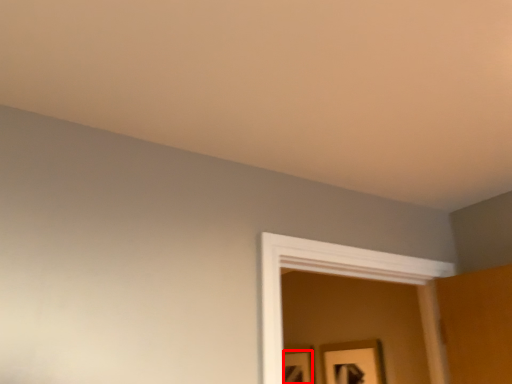
Question: From the image's perspective, what is the correct spatial positioning of picture frame (annotated by the red box) in reference to picture frame?

Choices:
 (A) below
 (B) above

Answer: (A)